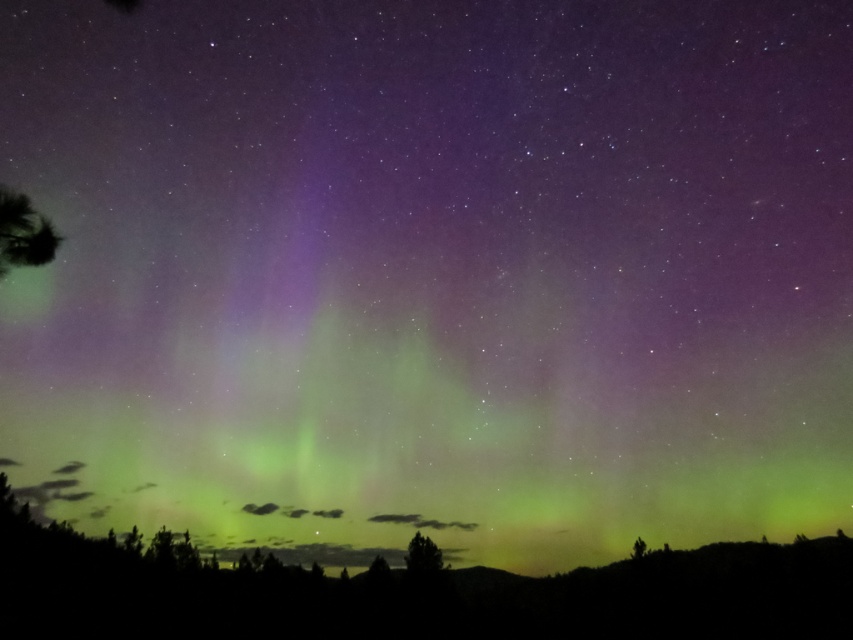
Does green matte tree at lower center appear under green matte tree at lower right?

Indeed, green matte tree at lower center is positioned under green matte tree at lower right.

Does green matte tree at lower center have a lesser width compared to green matte tree at lower right?

Yes, green matte tree at lower center is thinner than green matte tree at lower right.

Who is more forward, (426, 568) or (641, 552)?

Point (426, 568)

Where is `green matte tree at lower center`? The image size is (853, 640). green matte tree at lower center is located at coordinates (422, 556).

Is green leafy tree at left in front of green matte tree at lower right?

Yes, green leafy tree at left is closer to the viewer.

Can you confirm if green leafy tree at left is thinner than green matte tree at lower right?

No, green leafy tree at left is not thinner than green matte tree at lower right.

You are a GUI agent. You are given a task and a screenshot of the screen. Output one action in this format:
    pyautogui.click(x=<x>, y=<y>)
    Task: Click on the green leafy tree at left
    The height and width of the screenshot is (640, 853).
    Given the screenshot: What is the action you would take?
    pyautogui.click(x=22, y=232)

Locate an element on the screen. The height and width of the screenshot is (640, 853). green leafy tree at left is located at coordinates (22, 232).

Does green leafy tree at left have a lesser height compared to green matte tree at lower center?

No, green leafy tree at left is not shorter than green matte tree at lower center.

Is point (49, 227) behind point (416, 548)?

No, it is in front of (416, 548).

Identify the location of green leafy tree at left. Image resolution: width=853 pixels, height=640 pixels. (22, 232).